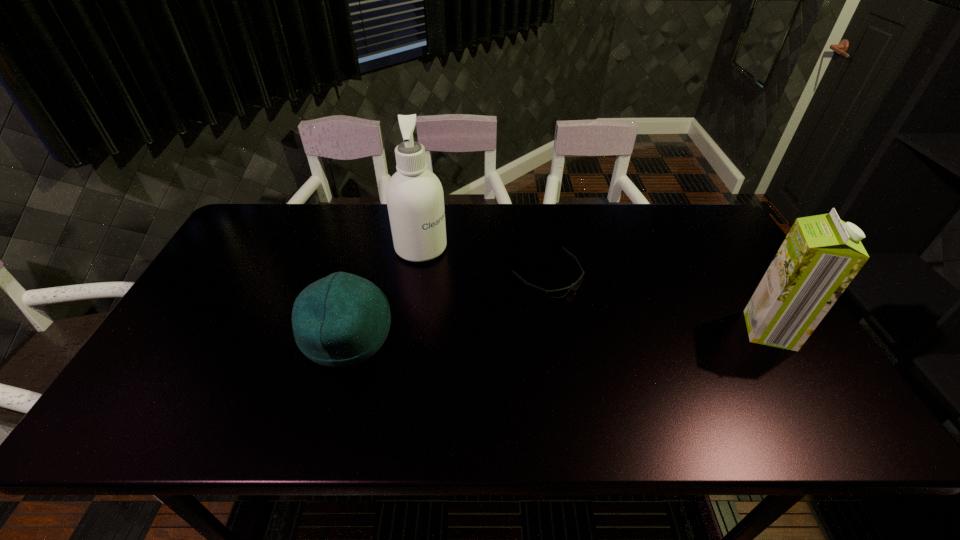
Identify the location of the second shortest object. The height and width of the screenshot is (540, 960). (341, 320).

At what (x,y) coordinates should I click in order to perform the action: click on the rightmost object. Please return your answer as a coordinate pair (x, y). The height and width of the screenshot is (540, 960). Looking at the image, I should click on (820, 256).

The image size is (960, 540). I want to click on the second tallest object, so click(820, 256).

Identify the location of sunglasses. (558, 293).

Where is `the shortest object`? The image size is (960, 540). the shortest object is located at coordinates (558, 293).

Where is `cleansing agent`? The width and height of the screenshot is (960, 540). cleansing agent is located at coordinates (415, 200).

Locate an element on the screen. The width and height of the screenshot is (960, 540). vacant area situated 0.380m on the back of the beanie is located at coordinates (379, 220).

Where is `free space located on the back of the soya milk`? The image size is (960, 540). free space located on the back of the soya milk is located at coordinates (731, 267).

Locate an element on the screen. The width and height of the screenshot is (960, 540). free space located on the front-facing side of the sunglasses is located at coordinates (605, 325).

The height and width of the screenshot is (540, 960). What are the coordinates of `vacant space located 0.140m on the front-facing side of the sunglasses` in the screenshot? It's located at (608, 327).